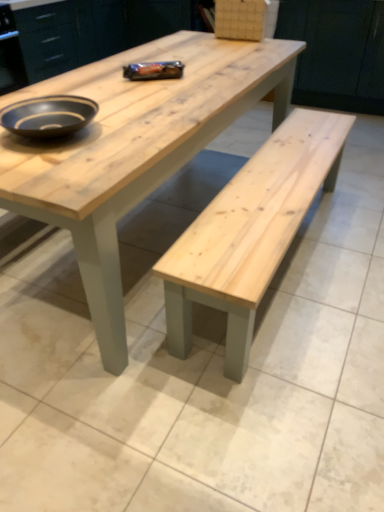
You are a GUI agent. You are given a task and a screenshot of the screen. Output one action in this format:
    pyautogui.click(x=<x>, y=<y>)
    Task: Click on the free spot in front of matte black bowl at upper left
    Image resolution: width=384 pixels, height=512 pixels.
    Given the screenshot: What is the action you would take?
    pyautogui.click(x=59, y=168)